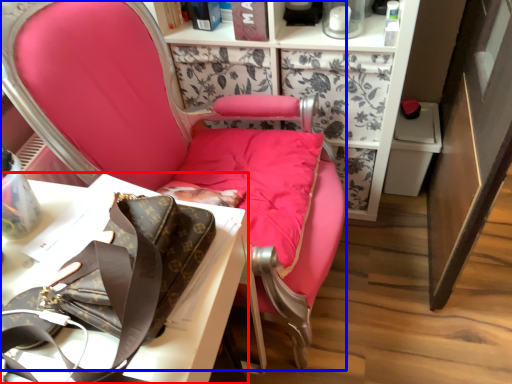
Question: Which of the following is the closest to the observer, desk (highlighted by a red box) or chair (highlighted by a blue box)?

Choices:
 (A) desk
 (B) chair

Answer: (B)